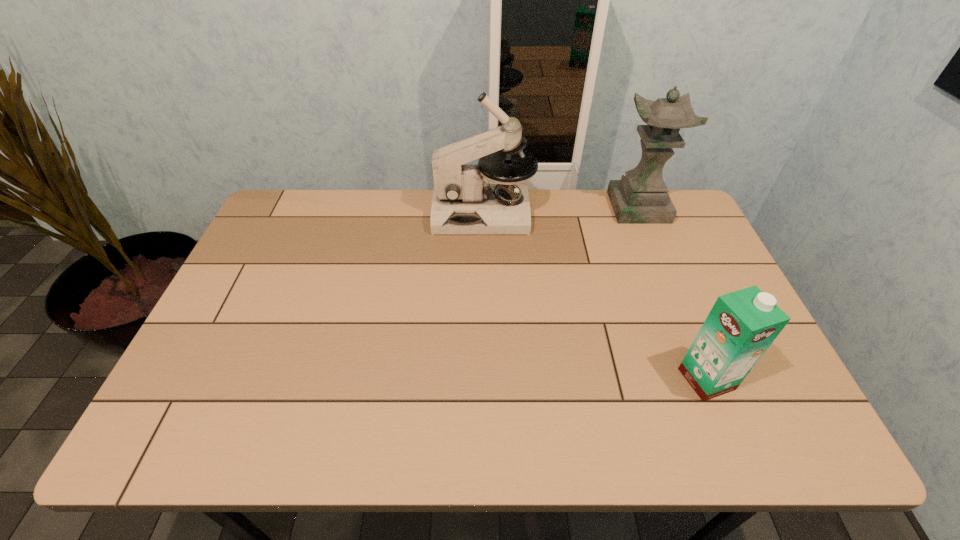
Image resolution: width=960 pixels, height=540 pixels. In order to click on vacant region located on the left of the nearest object in this screenshot , I will do `click(614, 379)`.

Image resolution: width=960 pixels, height=540 pixels. I want to click on sculpture located in the far edge section of the desktop, so click(640, 197).

Locate an element on the screen. This screenshot has width=960, height=540. microscope at the far edge is located at coordinates (464, 202).

Find the location of a particular element. The width and height of the screenshot is (960, 540). sculpture at the right edge is located at coordinates (640, 197).

Find the location of a particular element. carton at the right edge is located at coordinates (741, 326).

What are the coordinates of `object situated at the far right corner` in the screenshot? It's located at (640, 197).

I want to click on vacant point at the near edge, so pyautogui.click(x=512, y=437).

This screenshot has height=540, width=960. In the image, there is a desktop. In order to click on vacant area at the left edge in this screenshot , I will do `click(228, 325)`.

Find the location of a particular element. This screenshot has height=540, width=960. free space at the far left corner of the desktop is located at coordinates pyautogui.click(x=286, y=217).

Find the location of a particular element. vacant space at the near left corner is located at coordinates (205, 431).